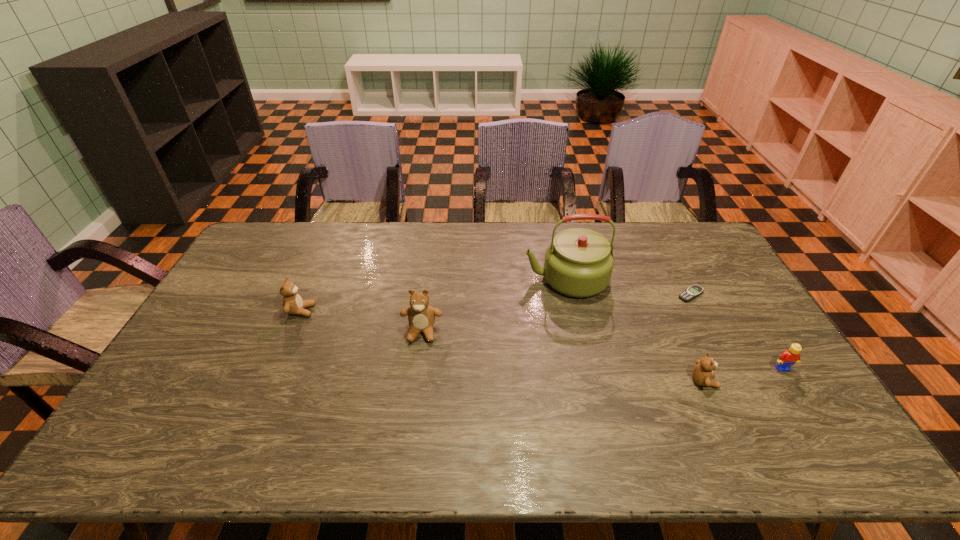
The height and width of the screenshot is (540, 960). I want to click on the rightmost object, so click(789, 357).

Identify the location of vacant position located 0.070m on the front-facing side of the fourth shortest object. The width and height of the screenshot is (960, 540). (337, 311).

The width and height of the screenshot is (960, 540). I want to click on free point located on the front-facing side of the second tallest object, so click(x=413, y=401).

Find the location of a particular element. free spot located on the front-facing side of the nearest teddy bear is located at coordinates (783, 381).

This screenshot has width=960, height=540. Find the location of `free region located on the right of the beeper`. free region located on the right of the beeper is located at coordinates (738, 294).

The image size is (960, 540). In order to click on vacant space located 0.400m at the spout of the fourth object from right to left in this screenshot , I will do `click(405, 279)`.

Locate an element on the screen. vacant point located at the spout of the fourth object from right to left is located at coordinates (428, 279).

This screenshot has height=540, width=960. I want to click on vacant region located at the spout of the fourth object from right to left, so click(x=508, y=279).

Locate an element on the screen. The width and height of the screenshot is (960, 540). vacant space located 0.070m on the front-facing side of the rightmost object is located at coordinates 799,394.

I want to click on object positioned at the far edge, so click(578, 262).